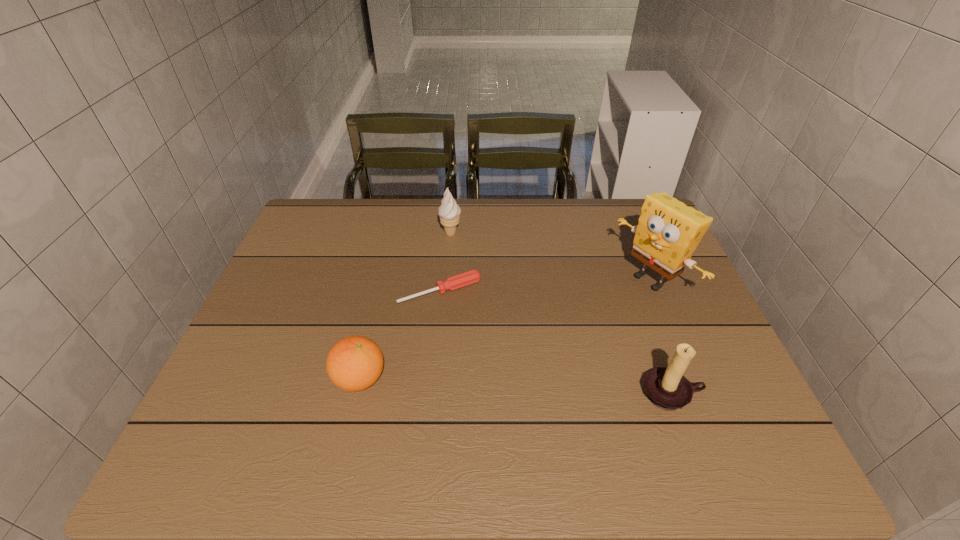
You are a GUI agent. You are given a task and a screenshot of the screen. Output one action in this format:
    pyautogui.click(x=<x>, y=<y>)
    Task: Click on the orange
    The width and height of the screenshot is (960, 540).
    Given the screenshot: What is the action you would take?
    pyautogui.click(x=354, y=363)

I want to click on candle holder, so click(666, 387).

The width and height of the screenshot is (960, 540). Find the location of `the farthest object`. the farthest object is located at coordinates (449, 211).

Where is `the tallest object`? the tallest object is located at coordinates pyautogui.click(x=668, y=232).

Where is `the shortest object`? Image resolution: width=960 pixels, height=540 pixels. the shortest object is located at coordinates (461, 280).

Find the location of a particular element. This screenshot has height=540, width=960. vacant area situated on the right of the second shortest object is located at coordinates (497, 379).

At what (x,y) coordinates should I click in order to perform the action: click on free space located on the front-facing side of the icecream. Please return your answer as a coordinate pair (x, y). This screenshot has height=540, width=960. Looking at the image, I should click on (453, 251).

This screenshot has width=960, height=540. I want to click on free region located on the front-facing side of the icecream, so click(463, 335).

Locate an element on the screen. The width and height of the screenshot is (960, 540). vacant space positioned 0.080m on the front-facing side of the icecream is located at coordinates (453, 257).

The height and width of the screenshot is (540, 960). In order to click on vacant region located 0.310m on the face of the tallest object in this screenshot , I will do `click(542, 352)`.